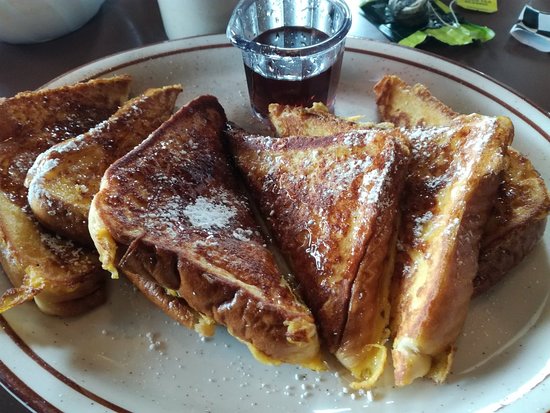
Image resolution: width=550 pixels, height=413 pixels. I want to click on plate, so click(526, 327).